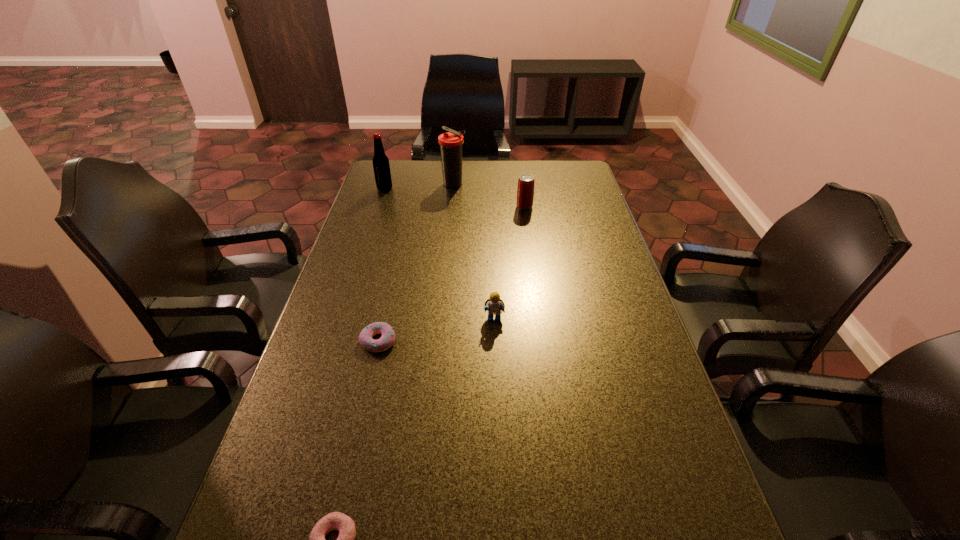
Find the location of a particular element. Image resolution: width=960 pixels, height=540 pixels. vacant area situated on the front-facing side of the fourth farthest object is located at coordinates click(495, 350).

Where is `free space located on the right of the second nearest object`? free space located on the right of the second nearest object is located at coordinates (520, 341).

Where is `thermos bottle that is at the far edge`? The image size is (960, 540). thermos bottle that is at the far edge is located at coordinates (451, 142).

Locate an element on the screen. The height and width of the screenshot is (540, 960). beer bottle situated at the far edge is located at coordinates (381, 166).

Identify the location of beer bottle located in the left edge section of the desktop. The width and height of the screenshot is (960, 540). (381, 166).

This screenshot has width=960, height=540. I want to click on doughnut that is at the left edge, so click(387, 339).

Identify the location of object located at the far left corner. (381, 166).

The width and height of the screenshot is (960, 540). I want to click on free space at the far edge of the desktop, so click(x=537, y=167).

In order to click on vacant space at the left edge of the desktop in this screenshot , I will do pos(396,210).

At what (x,y) coordinates should I click in order to perform the action: click on blank area at the right edge. Please return your answer as a coordinate pair (x, y). Looking at the image, I should click on (683, 483).